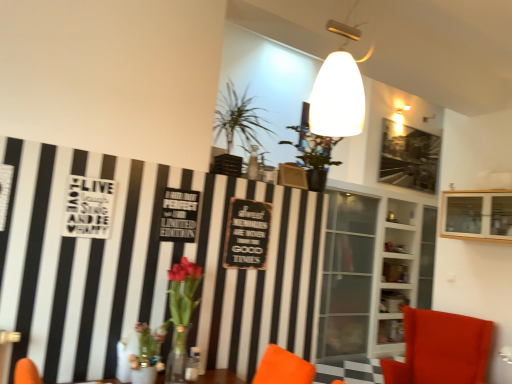
Question: Is translucent glass vase at lower left at the right side of green leafy plant at upper center?

Choices:
 (A) yes
 (B) no

Answer: (B)

Question: Is translucent glass vase at lower left shorter than green leafy plant at upper center?

Choices:
 (A) yes
 (B) no

Answer: (B)

Question: Is translucent glass vase at lower left turned away from green leafy plant at upper center?

Choices:
 (A) yes
 (B) no

Answer: (B)

Question: Considering the relative positions of translucent glass vase at lower left and green leafy plant at upper center in the image provided, is translucent glass vase at lower left to the left of green leafy plant at upper center from the viewer's perspective?

Choices:
 (A) yes
 (B) no

Answer: (A)

Question: From the image's perspective, would you say translucent glass vase at lower left is positioned over green leafy plant at upper center?

Choices:
 (A) yes
 (B) no

Answer: (B)

Question: Is translucent glass vase at lower left positioned in front of green leafy plant at upper center?

Choices:
 (A) no
 (B) yes

Answer: (B)

Question: From a real-world perspective, is white glass shelves at center, the 2th shelf when ordered from front to back, under wooden signboard at center?

Choices:
 (A) yes
 (B) no

Answer: (A)

Question: Considering the relative sizes of white glass shelves at center, the 2th shelf when ordered from front to back, and wooden signboard at center in the image provided, is white glass shelves at center, the 2th shelf when ordered from front to back, taller than wooden signboard at center?

Choices:
 (A) yes
 (B) no

Answer: (A)

Question: Is white glass shelves at center, the 2th shelf when ordered from front to back, positioned beyond the bounds of wooden signboard at center?

Choices:
 (A) yes
 (B) no

Answer: (A)

Question: Is white glass shelves at center, the 2th shelf when ordered from front to back, aimed at wooden signboard at center?

Choices:
 (A) yes
 (B) no

Answer: (B)

Question: From the image's perspective, is white glass shelves at center, which is the first shelf from back to front, located beneath wooden signboard at center?

Choices:
 (A) yes
 (B) no

Answer: (A)

Question: Is translucent glass vase at lower left surrounded by velvet orange chair at lower right?

Choices:
 (A) yes
 (B) no

Answer: (B)